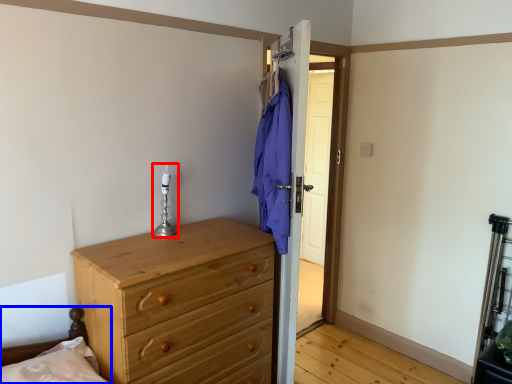
Question: Which of the following is the farthest to the observer, candle holder (highlighted by a red box) or bed frame (highlighted by a blue box)?

Choices:
 (A) candle holder
 (B) bed frame

Answer: (A)